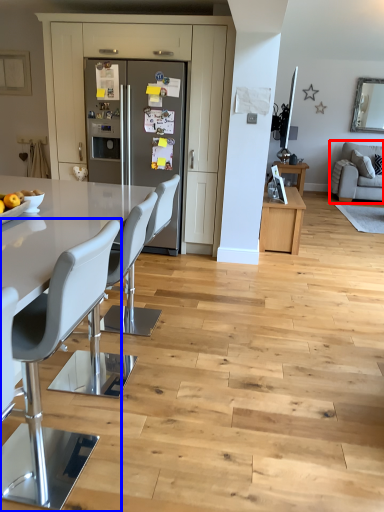
Question: Among these objects, which one is farthest to the camera, studio couch (highlighted by a red box) or chair (highlighted by a blue box)?

Choices:
 (A) studio couch
 (B) chair

Answer: (A)